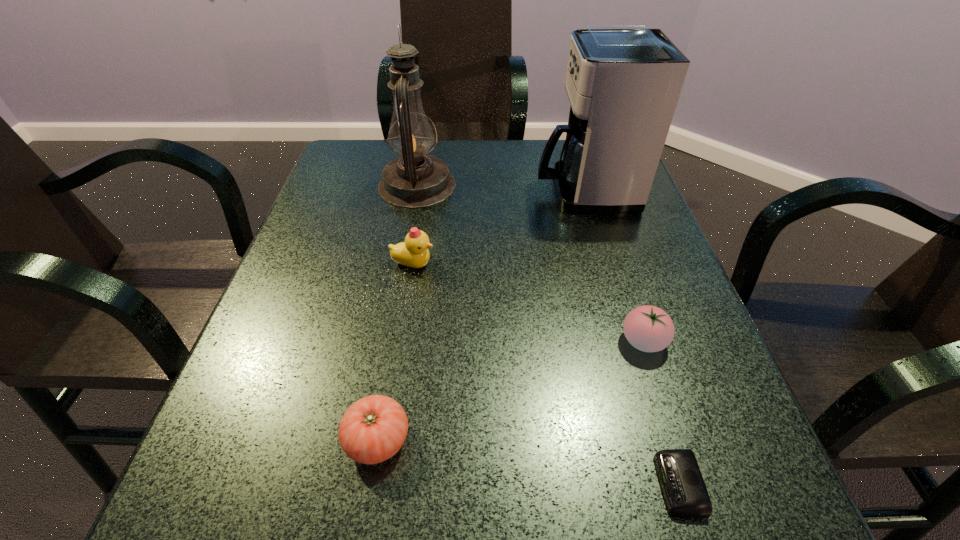
You are a GUI agent. You are given a task and a screenshot of the screen. Output one action in this format:
    pyautogui.click(x=<x>, y=<y>)
    Task: Click on the blank space at the near edge of the desktop
    
    Given the screenshot: What is the action you would take?
    pyautogui.click(x=336, y=508)

Locate an element on the screen. The width and height of the screenshot is (960, 540). free space at the left edge is located at coordinates (335, 289).

At what (x,y) coordinates should I click in order to perform the action: click on vacant space at the right edge of the desktop. Please return your answer as a coordinate pair (x, y). This screenshot has width=960, height=540. Looking at the image, I should click on (632, 288).

At what (x,y) coordinates should I click in order to perform the action: click on free space at the far left corner. Please return your answer as a coordinate pair (x, y). Looking at the image, I should click on (352, 183).

Locate an element on the screen. This screenshot has width=960, height=540. vacant area that lies between the left tomato and the coffee maker is located at coordinates (481, 315).

The height and width of the screenshot is (540, 960). I want to click on empty space that is in between the coffee maker and the left tomato, so click(481, 315).

This screenshot has width=960, height=540. I want to click on unoccupied area between the shortest object and the fourth farthest object, so click(661, 413).

At what (x,y) coordinates should I click in order to perform the action: click on empty space between the right tomato and the coffee maker. Please return your answer as a coordinate pair (x, y). The width and height of the screenshot is (960, 540). Looking at the image, I should click on (614, 266).

You are a GUI agent. You are given a task and a screenshot of the screen. Output one action in this format:
    pyautogui.click(x=<x>, y=<y>)
    Task: Click on the empty space between the shortest object and the left tomato
    This screenshot has height=540, width=960.
    Given the screenshot: What is the action you would take?
    pyautogui.click(x=528, y=462)

This screenshot has width=960, height=540. I want to click on empty space between the farther tomato and the alarm clock, so click(661, 413).